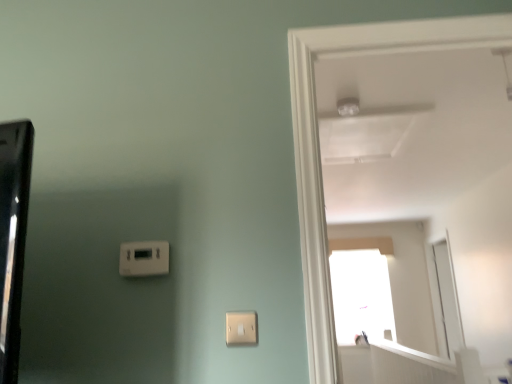
Question: Does point (510, 19) appear closer or farther from the camera than point (163, 244)?

Choices:
 (A) farther
 (B) closer

Answer: (A)

Question: Considering their positions, is white glossy door at upper right located in front of or behind white plastic thermostat at lower left, which is the 2th light switch in bottom-to-top order?

Choices:
 (A) behind
 (B) front

Answer: (B)

Question: Estimate the real-world distances between objects in this image. Which object is closer to the white plastic light switch at lower center, positioned as the second light switch in top-to-bottom order?

Choices:
 (A) white glossy door at upper right
 (B) white plastic thermostat at lower left, which is the 2th light switch in bottom-to-top order

Answer: (B)

Question: Which object is the farthest from the white plastic thermostat at lower left, placed as the first light switch when sorted from top to bottom?

Choices:
 (A) white glossy door at upper right
 (B) white plastic light switch at lower center, the 2th light switch positioned from the back

Answer: (A)